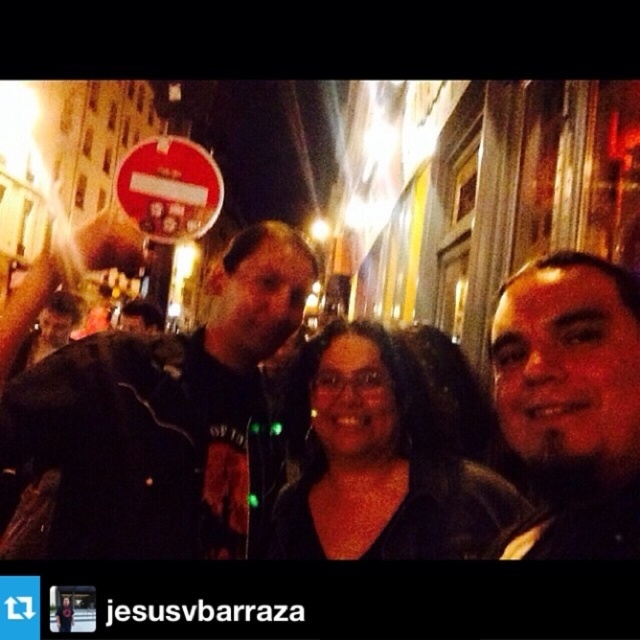
Identify the location of black leather jacket at left. (160, 412).

Between black leather jacket at left and black matte glasses at center, which one is positioned higher?

black leather jacket at left is higher up.

Does point (248, 410) lie in front of point (372, 362)?

No, (248, 410) is behind (372, 362).

The width and height of the screenshot is (640, 640). Identify the location of black leather jacket at left. (160, 412).

Is point (128, 448) more distant than point (516, 305)?

Yes, it is.

Which is in front, point (61, 476) or point (596, 417)?

Point (596, 417) is in front.

You are a GUI agent. You are given a task and a screenshot of the screen. Output one action in this format:
    pyautogui.click(x=<x>, y=<y>)
    Task: Click on the black leather jacket at left
    Image resolution: width=640 pixels, height=640 pixels.
    Given the screenshot: What is the action you would take?
    pyautogui.click(x=160, y=412)

Who is shorter, dark brown leather jacket at right or black matte glasses at center?

dark brown leather jacket at right

Does dark brown leather jacket at right appear under black matte glasses at center?

Incorrect, dark brown leather jacket at right is not positioned below black matte glasses at center.

Locate an element on the screen. dark brown leather jacket at right is located at coordinates 572,403.